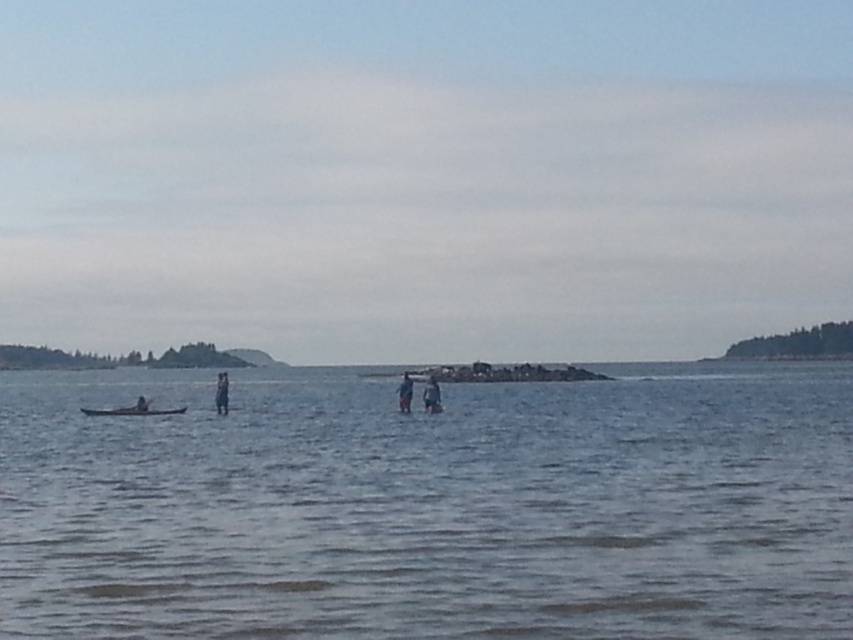
Question: Which object is the farthest from the smooth blue pants at center?

Choices:
 (A) dark blue fabric at center
 (B) smooth wooden paddleboard at left
 (C) smooth brown canoe at lower left
 (D) clear water at center

Answer: (D)

Question: Among these points, which one is nearest to the camera?

Choices:
 (A) (222, 381)
 (B) (144, 410)
 (C) (431, 380)
 (D) (146, 413)

Answer: (C)

Question: Considering the relative positions of smooth brown canoe at lower left and smooth blue pants at center in the image provided, where is smooth brown canoe at lower left located with respect to smooth blue pants at center?

Choices:
 (A) left
 (B) right

Answer: (A)

Question: Is dark blue fabric at center smaller than smooth wooden paddleboard at left?

Choices:
 (A) yes
 (B) no

Answer: (B)

Question: Considering the relative positions of smooth brown canoe at lower left and dark blue fabric at center in the image provided, where is smooth brown canoe at lower left located with respect to dark blue fabric at center?

Choices:
 (A) below
 (B) above

Answer: (A)

Question: Which point is farther from the camera taking this photo?

Choices:
 (A) (430, 385)
 (B) (225, 385)
 (C) (132, 416)

Answer: (C)